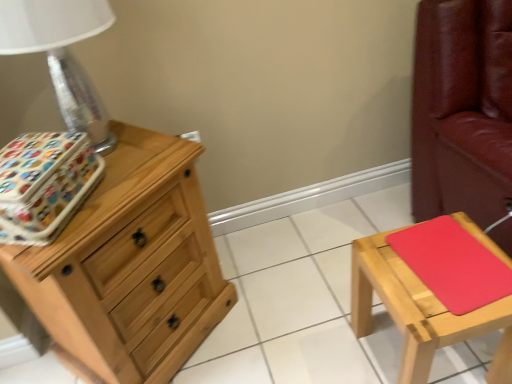
What are the coordinates of `vacant point to the right of patterned fabric storage box at left` in the screenshot? It's located at (131, 182).